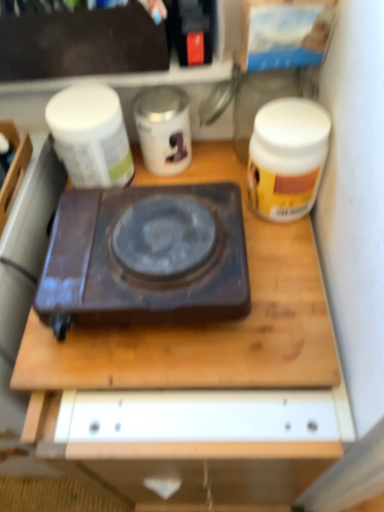
Question: Is the position of matte black box at upper left less distant than that of transparent glass jar at upper center?

Choices:
 (A) yes
 (B) no

Answer: (A)

Question: Is matte black box at upper left beside transparent glass jar at upper center?

Choices:
 (A) yes
 (B) no

Answer: (B)

Question: Is matte black box at upper left taller than transparent glass jar at upper center?

Choices:
 (A) yes
 (B) no

Answer: (B)

Question: Could you tell me if matte black box at upper left is facing transparent glass jar at upper center?

Choices:
 (A) no
 (B) yes

Answer: (A)

Question: Is matte black box at upper left not near transparent glass jar at upper center?

Choices:
 (A) yes
 (B) no

Answer: (B)

Question: Choose the correct answer: Is wooden desk at center inside matte black box at upper left or outside it?

Choices:
 (A) outside
 (B) inside

Answer: (A)

Question: Is wooden desk at center to the left or to the right of matte black box at upper left in the image?

Choices:
 (A) left
 (B) right

Answer: (B)

Question: Is wooden desk at center bigger or smaller than matte black box at upper left?

Choices:
 (A) small
 (B) big

Answer: (B)

Question: From the image's perspective, is wooden desk at center located above or below matte black box at upper left?

Choices:
 (A) above
 (B) below

Answer: (B)

Question: From their relative heights in the image, would you say matte black box at upper left is taller or shorter than wooden desk at center?

Choices:
 (A) short
 (B) tall

Answer: (A)

Question: Considering the positions of matte black box at upper left and wooden desk at center in the image, is matte black box at upper left bigger or smaller than wooden desk at center?

Choices:
 (A) small
 (B) big

Answer: (A)

Question: Relative to wooden desk at center, is matte black box at upper left in front or behind?

Choices:
 (A) behind
 (B) front

Answer: (A)

Question: Considering the positions of point pyautogui.click(x=62, y=69) and point pyautogui.click(x=254, y=291), is point pyautogui.click(x=62, y=69) closer or farther from the camera than point pyautogui.click(x=254, y=291)?

Choices:
 (A) farther
 (B) closer

Answer: (A)

Question: From a real-world perspective, is transparent glass jar at upper center above or below yellow matte jar at right?

Choices:
 (A) above
 (B) below

Answer: (A)

Question: Would you say transparent glass jar at upper center is inside or outside yellow matte jar at right?

Choices:
 (A) inside
 (B) outside

Answer: (B)